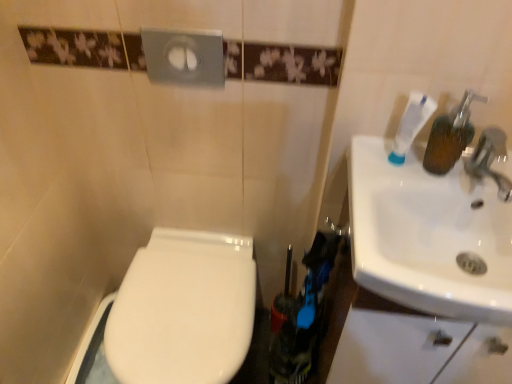
Where is `white matte toothpaste at upper right`? The height and width of the screenshot is (384, 512). white matte toothpaste at upper right is located at coordinates (411, 125).

The image size is (512, 384). I want to click on white glossy toilet at lower left, so click(181, 318).

Between white matte toothpaste at upper right and white glossy sink at right, which one has larger width?

white glossy sink at right.

Is white matte toothpaste at upper right taller or shorter than white glossy sink at right?

In the image, white matte toothpaste at upper right appears to be taller than white glossy sink at right.

At what (x,y) coordinates should I click in order to perform the action: click on toothpaste located above the white glossy sink at right (from a real-world perspective). Please return your answer as a coordinate pair (x, y). The image size is (512, 384). Looking at the image, I should click on (411, 125).

Which is farther from the camera, (400, 132) or (455, 232)?

The point (455, 232) is behind.

From a real-world perspective, relative to white glossy toilet at lower left, is white matte toothpaste at upper right vertically above or below?

white matte toothpaste at upper right is situated higher than white glossy toilet at lower left in the real world.

I want to click on bidet below the white matte toothpaste at upper right (from a real-world perspective), so click(181, 318).

Which is in front, point (419, 130) or point (181, 377)?

Point (419, 130)

From a real-world perspective, which object rests below the other?

white glossy toilet at lower left.

Considering their positions, is white glossy sink at right located in front of or behind white glossy toilet at lower left?

white glossy sink at right is in front of white glossy toilet at lower left.

Between white glossy sink at right and white glossy toilet at lower left, which one has smaller size?

Smaller between the two is white glossy sink at right.

Is there a large distance between white glossy sink at right and white glossy toilet at lower left?

No.

Looking at this image, could you tell me if white glossy toilet at lower left is turned towards white glossy sink at right?

No, white glossy toilet at lower left does not turn towards white glossy sink at right.

From the image's perspective, is white glossy toilet at lower left under white glossy sink at right?

Yes, from the image's perspective, white glossy toilet at lower left is below white glossy sink at right.

Based on the photo, are white glossy toilet at lower left and white glossy sink at right located far from each other?

Actually, white glossy toilet at lower left and white glossy sink at right are a little close together.

Between white glossy sink at right and white matte toothpaste at upper right, which one is positioned behind?

white matte toothpaste at upper right is further away from the camera.

Is white glossy sink at right spatially inside white matte toothpaste at upper right, or outside of it?

white glossy sink at right cannot be found inside white matte toothpaste at upper right.

This screenshot has height=384, width=512. In order to click on toothpaste that is above the white glossy sink at right (from a real-world perspective) in this screenshot , I will do `click(411, 125)`.

Is white glossy sink at right facing towards white matte toothpaste at upper right?

No, white glossy sink at right is not oriented towards white matte toothpaste at upper right.

Does white glossy toilet at lower left have a lesser height compared to white matte toothpaste at upper right?

No, white glossy toilet at lower left is not shorter than white matte toothpaste at upper right.

Considering their positions, is white glossy toilet at lower left located in front of or behind white matte toothpaste at upper right?

Visually, white glossy toilet at lower left is located behind white matte toothpaste at upper right.

From a real-world perspective, which is physically above, white glossy toilet at lower left or white matte toothpaste at upper right?

From a 3D spatial view, white matte toothpaste at upper right is above.

Considering the sizes of objects white glossy toilet at lower left and white matte toothpaste at upper right in the image provided, who is thinner, white glossy toilet at lower left or white matte toothpaste at upper right?

Thinner between the two is white matte toothpaste at upper right.

I want to click on sink lying on the right of white matte toothpaste at upper right, so click(x=429, y=235).

At what (x,y) coordinates should I click in order to perform the action: click on toothpaste above the white glossy toilet at lower left (from the image's perspective). Please return your answer as a coordinate pair (x, y). Looking at the image, I should click on (411, 125).

Looking at the image, which one is located further to white glossy toilet at lower left, white glossy sink at right or white matte toothpaste at upper right?

white matte toothpaste at upper right is further to white glossy toilet at lower left.

When comparing their distances from white glossy sink at right, does white glossy toilet at lower left or white matte toothpaste at upper right seem closer?

Based on the image, white matte toothpaste at upper right appears to be nearer to white glossy sink at right.

Looking at this image, based on their spatial positions, is white matte toothpaste at upper right or white glossy sink at right further from white glossy toilet at lower left?

white matte toothpaste at upper right is positioned further to the anchor white glossy toilet at lower left.

Based on the photo, when comparing their distances from white glossy sink at right, does white matte toothpaste at upper right or white glossy toilet at lower left seem closer?

The object closer to white glossy sink at right is white matte toothpaste at upper right.

When comparing their distances from white matte toothpaste at upper right, does white glossy sink at right or white glossy toilet at lower left seem closer?

white glossy sink at right lies closer to white matte toothpaste at upper right than the other object.

From the image, which object appears to be nearer to white matte toothpaste at upper right, white glossy toilet at lower left or white glossy sink at right?

white glossy sink at right lies closer to white matte toothpaste at upper right than the other object.

This screenshot has width=512, height=384. Identify the location of toothpaste located between white glossy toilet at lower left and white glossy sink at right in the left-right direction. (411, 125).